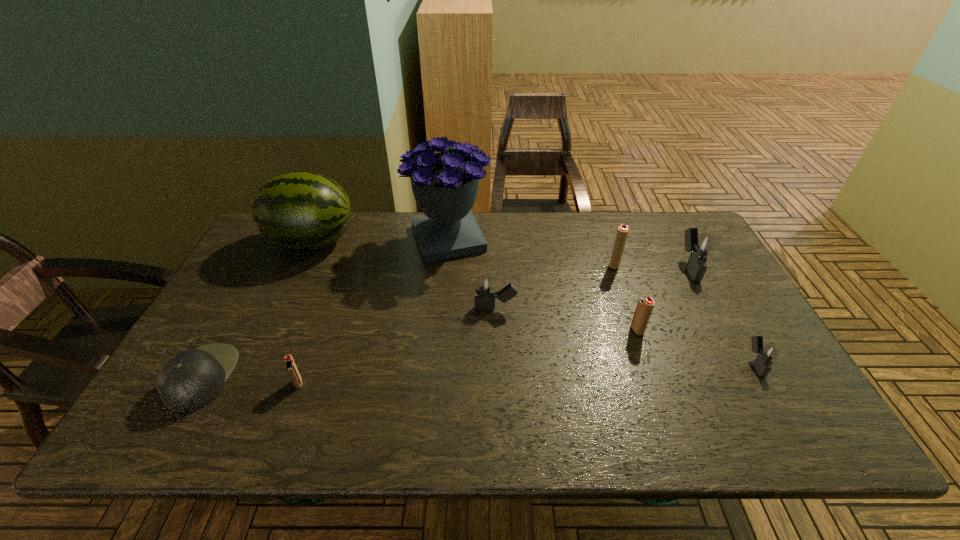
You are a GUI agent. You are given a task and a screenshot of the screen. Output one action in this format:
    pyautogui.click(x=<x>, y=<y>)
    Task: Click on the object at the near left corner
    
    Given the screenshot: What is the action you would take?
    pyautogui.click(x=190, y=380)

Identify the location of object present at the far right corner. The height and width of the screenshot is (540, 960). (700, 246).

The width and height of the screenshot is (960, 540). In the image, there is a desktop. In order to click on vacant space at the far edge in this screenshot , I will do `click(380, 218)`.

At what (x,y) coordinates should I click in order to perform the action: click on vacant space at the near edge of the desktop. Please return your answer as a coordinate pair (x, y). This screenshot has width=960, height=540. Looking at the image, I should click on (575, 442).

Where is `free space at the left edge`? The height and width of the screenshot is (540, 960). free space at the left edge is located at coordinates (246, 363).

The height and width of the screenshot is (540, 960). I want to click on vacant space at the far left corner of the desktop, so click(279, 247).

This screenshot has height=540, width=960. In the image, there is a desktop. In order to click on free space at the near left corner in this screenshot , I will do `click(214, 416)`.

You are a GUI agent. You are given a task and a screenshot of the screen. Output one action in this format:
    pyautogui.click(x=<x>, y=<y>)
    Task: Click on the empty space that is in between the second farthest red igniter and the purple bouquet
    
    Given the screenshot: What is the action you would take?
    pyautogui.click(x=543, y=285)

Identify the location of free point between the fourth nearest object and the biggest gray igniter. (662, 299).

You are a GUI agent. You are given a task and a screenshot of the screen. Output one action in this format:
    pyautogui.click(x=<x>, y=<y>)
    Task: Click on the free space between the cap and the farthest gray igniter
    The height and width of the screenshot is (540, 960).
    Given the screenshot: What is the action you would take?
    pyautogui.click(x=445, y=322)